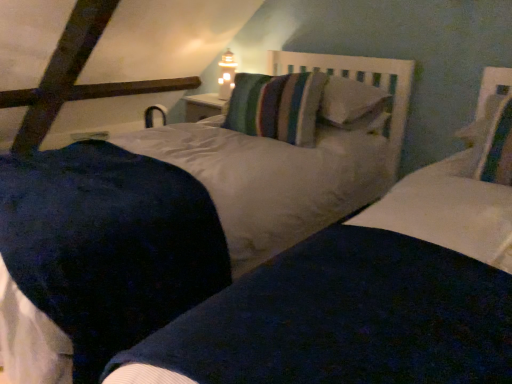
Measure the distance between point (233, 69) and camera.

A distance of 2.91 meters exists between point (233, 69) and camera.

Where is `white ceramic light fixture at upper center`? The height and width of the screenshot is (384, 512). white ceramic light fixture at upper center is located at coordinates (226, 75).

Describe the element at coordinates (226, 75) in the screenshot. Image resolution: width=512 pixels, height=384 pixels. I see `white ceramic light fixture at upper center` at that location.

At what (x,y) coordinates should I click in order to perform the action: click on white ceramic light fixture at upper center. Please return your answer as a coordinate pair (x, y). Looking at the image, I should click on (226, 75).